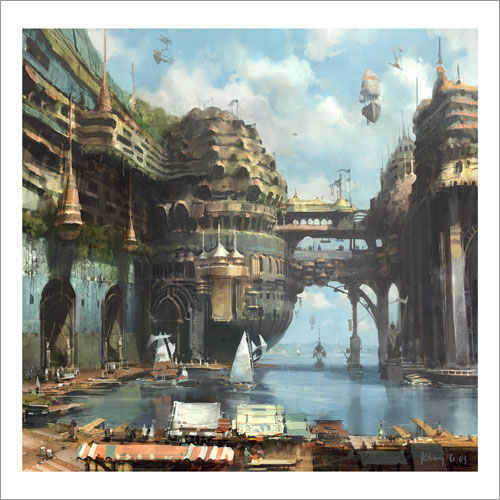
In order to click on support column in this screenshot , I will do `click(456, 300)`, `click(382, 328)`, `click(355, 328)`.